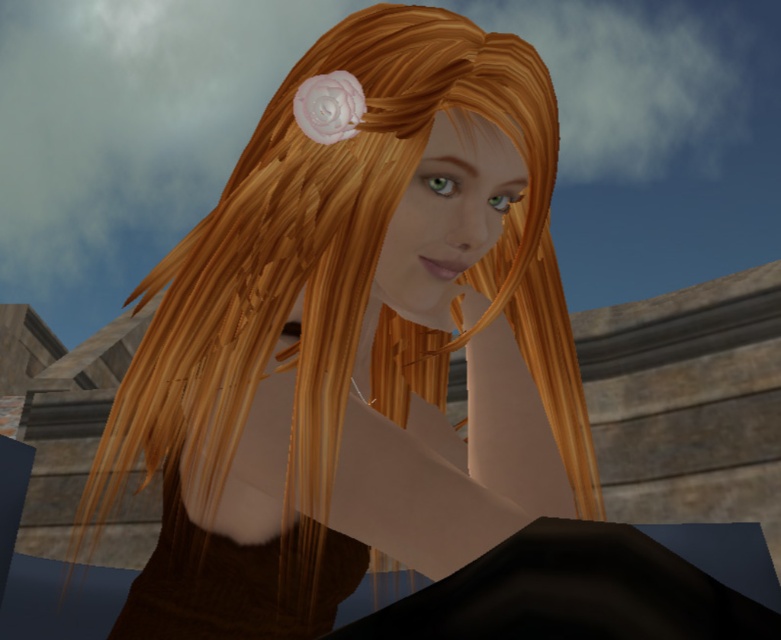
You are a photographer adjusting the lighting for a portrait. You need to ensure that the shiny brown hair at center and the white matte flower at upper center are both clearly visible. Which object should you focus on first to avoid obscuring details?

The shiny brown hair at center is in front of the white matte flower at upper center, so you should focus on the shiny brown hair at center first to ensure its details are clear without being blocked by the flower.

You are an artist sketching the scene and want to place a signature in the lower right corner of your drawing. Considering the placement of the brown textured dress at center, where should you position your signature to avoid overlapping it?

The brown textured dress at center is located at point (237, 579), so you should place your signature in the lower right corner of the drawing, which is outside the coordinates occupied by the dress.